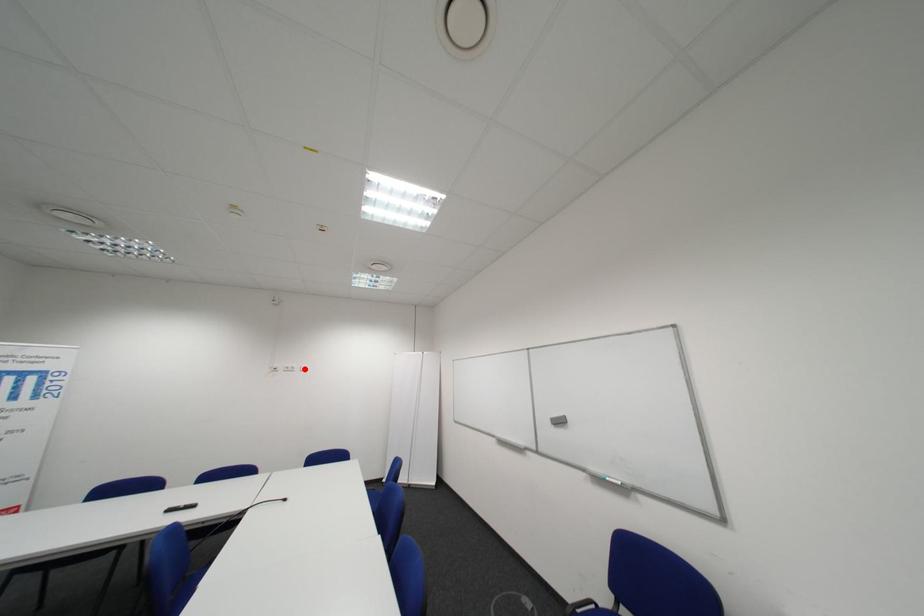
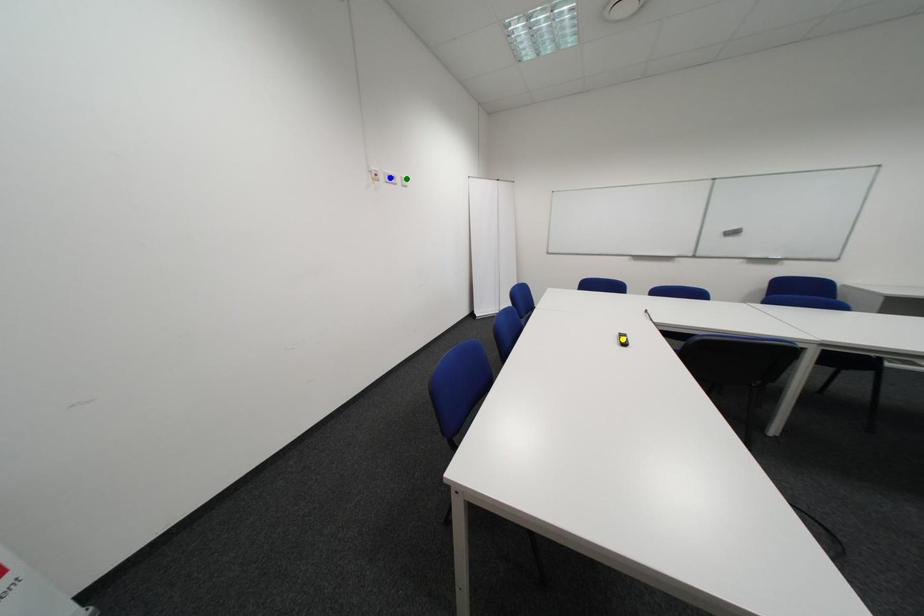
Question: I am providing you with two images of the same scene from different viewpoints. A red point is marked on the first image. You are given multiple points on the second image. Which spot in image 2 lines up with the point in image 1?

Choices:
 (A) blue point
 (B) green point
 (C) yellow point

Answer: (B)